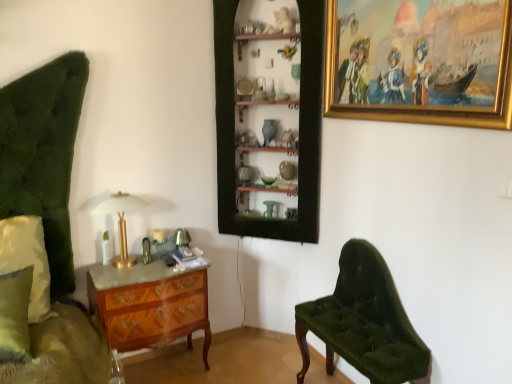
The image size is (512, 384). I want to click on free point below gold metallic table lamp at center (from a real-world perspective), so click(x=123, y=263).